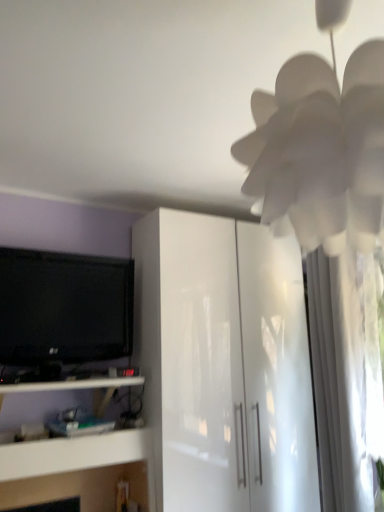
Question: From a real-world perspective, is white paper flower at upper right on white sheer curtain at right?

Choices:
 (A) yes
 (B) no

Answer: (A)

Question: Does white paper flower at upper right contain white sheer curtain at right?

Choices:
 (A) yes
 (B) no

Answer: (B)

Question: Is white paper flower at upper right not near white sheer curtain at right?

Choices:
 (A) yes
 (B) no

Answer: (A)

Question: Does white paper flower at upper right turn towards white sheer curtain at right?

Choices:
 (A) yes
 (B) no

Answer: (B)

Question: Considering the relative sizes of white paper flower at upper right and white sheer curtain at right in the image provided, is white paper flower at upper right bigger than white sheer curtain at right?

Choices:
 (A) yes
 (B) no

Answer: (A)

Question: Is white paper flower at upper right at the left side of white sheer curtain at right?

Choices:
 (A) yes
 (B) no

Answer: (A)

Question: Considering the relative sizes of black glossy tv at left and glossy white cabinet at center in the image provided, is black glossy tv at left shorter than glossy white cabinet at center?

Choices:
 (A) no
 (B) yes

Answer: (B)

Question: From the image's perspective, is black glossy tv at left under glossy white cabinet at center?

Choices:
 (A) no
 (B) yes

Answer: (A)

Question: Considering the relative positions of black glossy tv at left and glossy white cabinet at center in the image provided, is black glossy tv at left behind glossy white cabinet at center?

Choices:
 (A) no
 (B) yes

Answer: (B)

Question: Can you confirm if black glossy tv at left is thinner than glossy white cabinet at center?

Choices:
 (A) no
 (B) yes

Answer: (B)

Question: Can you confirm if black glossy tv at left is positioned to the left of glossy white cabinet at center?

Choices:
 (A) yes
 (B) no

Answer: (A)

Question: Is black glossy tv at left positioned before glossy white cabinet at center?

Choices:
 (A) yes
 (B) no

Answer: (B)

Question: From a real-world perspective, is white paper flower at upper right under white glossy shelf at lower left?

Choices:
 (A) no
 (B) yes

Answer: (A)